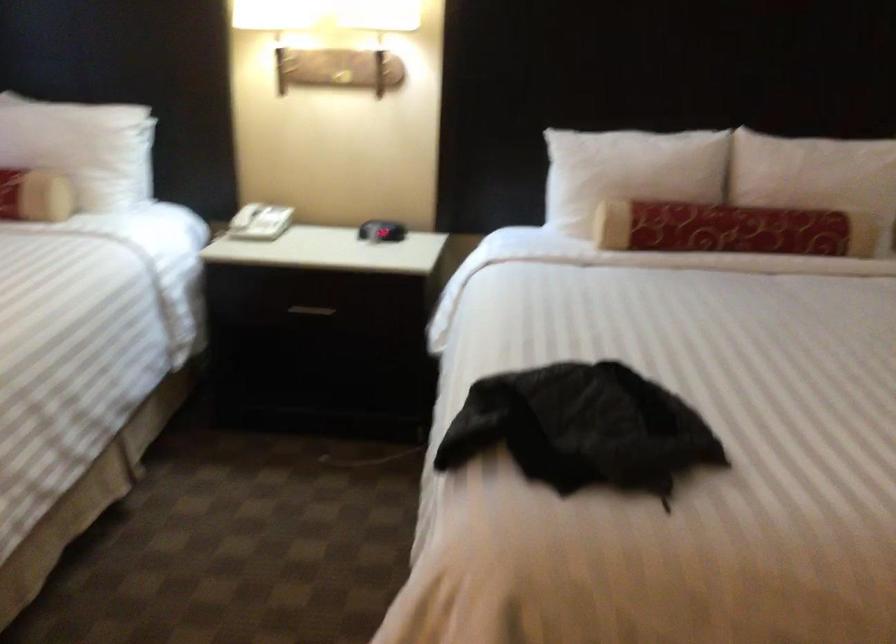
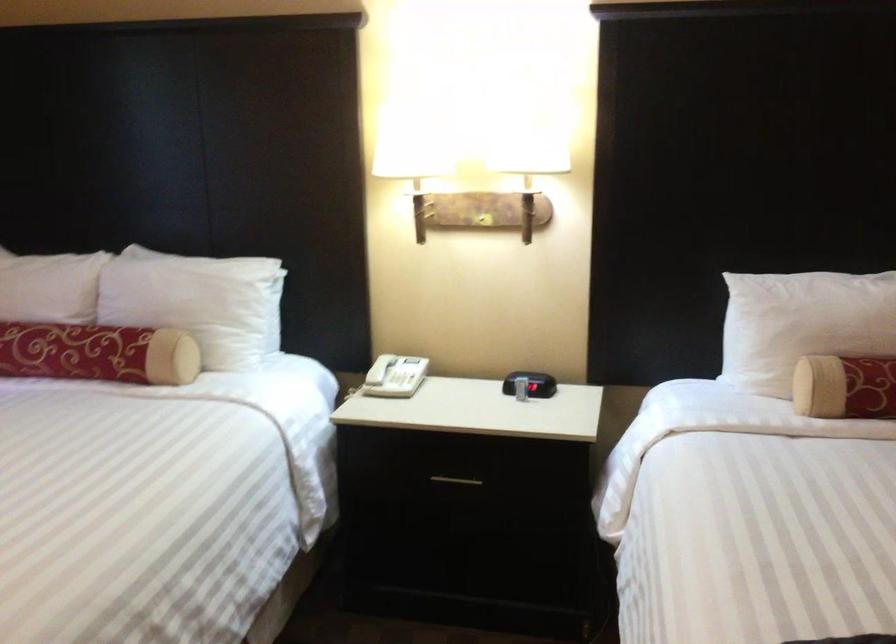
Find the pixel in the second image that matches (x=340, y=79) in the first image.

(483, 220)